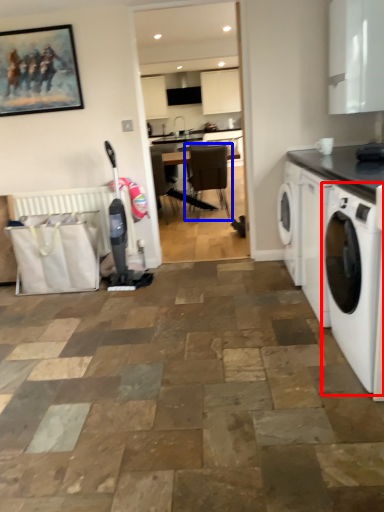
Question: Which of the following is the farthest to the observer, washing machine (highlighted by a red box) or chair (highlighted by a blue box)?

Choices:
 (A) washing machine
 (B) chair

Answer: (B)